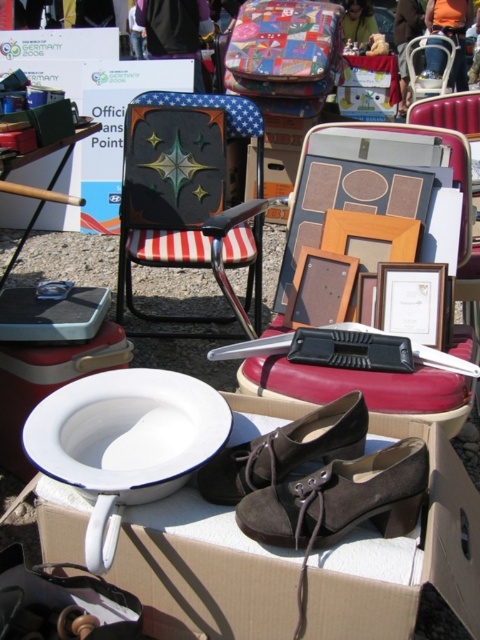
You are setting up a small outdoor display and have a space that can accommodate items up to 1 meter in width. You have a metallic painted chair at center and a brown suede shoe at center. Which item should you place in the space if you want the widest possible item that fits?

The metallic painted chair at center might be wider than brown suede shoe at center, so if it fits within the 1 meter width limit, it would be the better choice for the widest possible item. However, if the chair exceeds the 1 meter width, then the brown suede shoe at center should be placed instead.

You are setting up a small outdoor seating area and have both the metallic painted chair at center and the white enamel toilet at center. If you want to place them side by side, which one will require less space horizontally?

The metallic painted chair at center requires less horizontal space because its width is less than that of the white enamel toilet at center.

You are setting up a display at a flea market and need to know if the brown suede shoe at center will fit inside the white cardboard box at center. Based on the scene description, can the shoe fit inside the box?

The white cardboard box at center is wider than the brown suede shoe at center, so the shoe should fit inside the box.